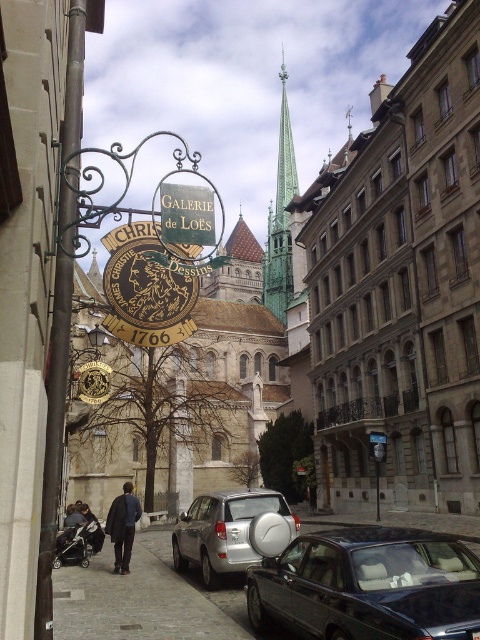
You are a delivery person trying to park your delivery van on the gray cobblestone pavement at lower center. However, there is a shiny black car at lower right blocking part of the area. Can you still park your van there without moving the car?

The shiny black car at lower right is positioned over the gray cobblestone pavement at lower center, so part of the parking area is blocked. You may need to adjust your parking spot or wait for the car to leave to fully access the area.

You are a tourist standing at the intersection and want to take a photo of the golden stone church at center without the shiny black car at lower right appearing in the frame. Is this possible given their positions?

The golden stone church at center is located above the shiny black car at lower right, so if you position yourself to angle the camera upwards, you can capture the church without the car obstructing the view.

You are standing on the cobblestone street in the scene and see two points marked on the buildings. Which point is closer to you, point 1 at coordinates [242,403] or point 2 at coordinates [260,580]?

Point 1 at coordinates [242,403] is closer to you because it is further to the viewer than point 2 at coordinates [260,580].